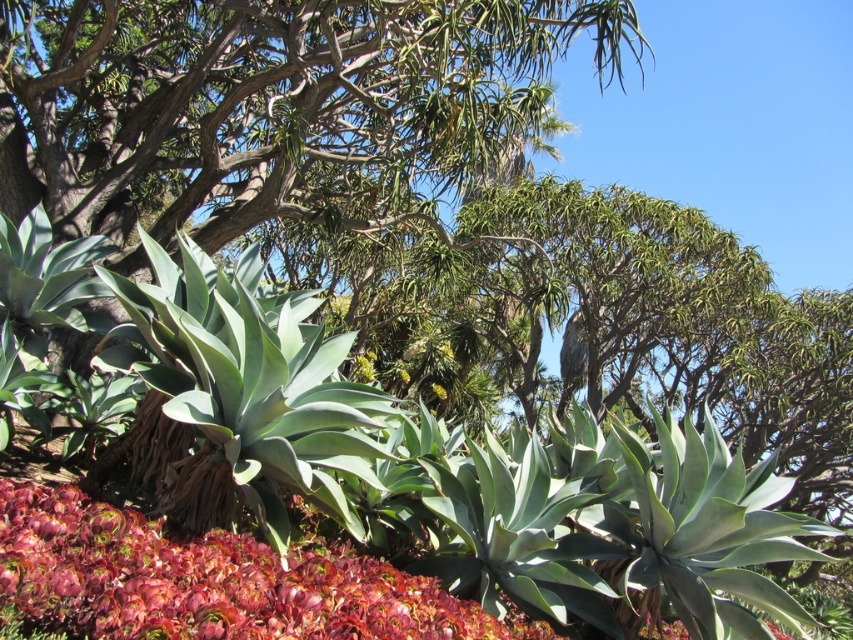
Does green leafy tree at center appear on the left side of smooth red flower at lower left?

In fact, green leafy tree at center is to the right of smooth red flower at lower left.

Is green leafy tree at center positioned before smooth red flower at lower left?

No, green leafy tree at center is behind smooth red flower at lower left.

Image resolution: width=853 pixels, height=640 pixels. What are the coordinates of `green leafy tree at center` in the screenshot? It's located at (270, 108).

In order to click on green leafy tree at center in this screenshot , I will do `click(270, 108)`.